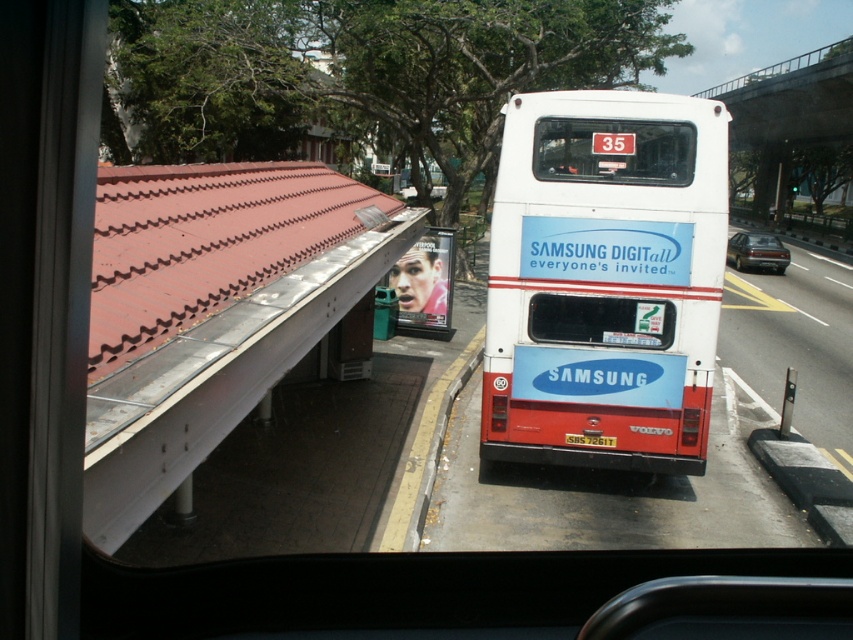
Between point (801, 296) and point (747, 240), which one is positioned behind?

Point (747, 240)

Measure the distance between point (735,356) and camera.

Point (735,356) is 50.57 feet from camera.

Where is `yellow painted asphalt at right`? This screenshot has width=853, height=640. yellow painted asphalt at right is located at coordinates (795, 342).

Find the location of a particular element. The height and width of the screenshot is (640, 853). white matte bus at center is located at coordinates (604, 280).

Can you confirm if white matte bus at center is positioned to the left of white glossy bus at right?

Correct, you'll find white matte bus at center to the left of white glossy bus at right.

Locate an element on the screen. The width and height of the screenshot is (853, 640). white matte bus at center is located at coordinates (604, 280).

From the picture: Is white matte bus at center wider than yellow painted asphalt at right?

No, white matte bus at center is not wider than yellow painted asphalt at right.

Describe the element at coordinates (604, 280) in the screenshot. I see `white matte bus at center` at that location.

Locate an element on the screen. Image resolution: width=853 pixels, height=640 pixels. white matte bus at center is located at coordinates (604, 280).